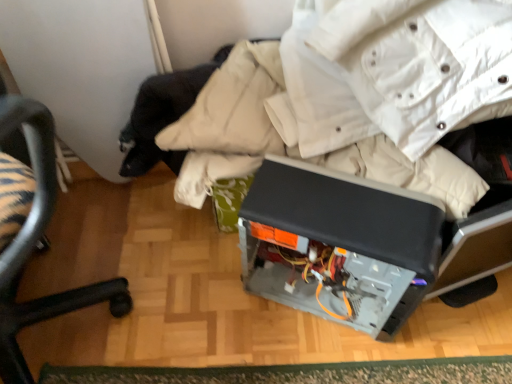
In order to click on vacant area that lies between satin black computer case at center and green textured mat at lower center in this screenshot , I will do [x=252, y=326].